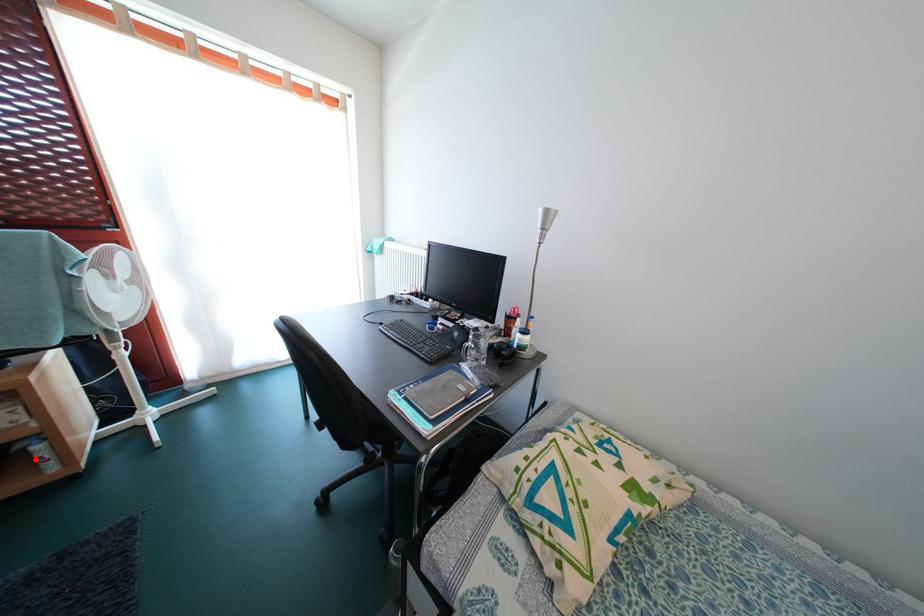
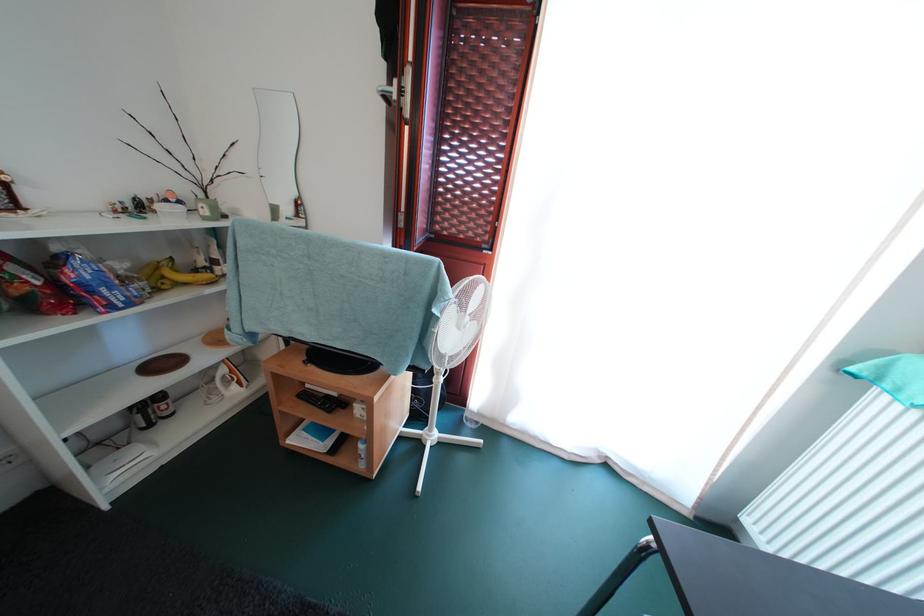
The point at the highlighted location is marked in the first image. Where is the corresponding point in the second image?

(363, 453)